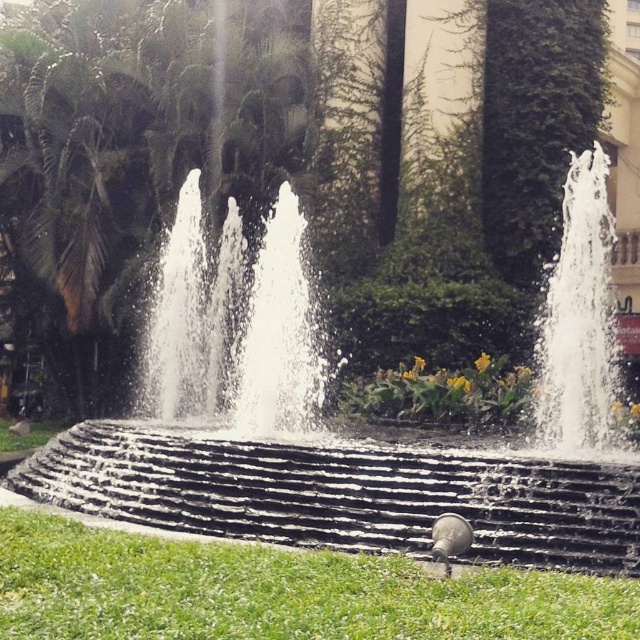
Between point (401, 589) and point (579, 161), which one is positioned in front?

Positioned in front is point (401, 589).

Describe the element at coordinates (276, 593) in the screenshot. I see `green grass at lower center` at that location.

Describe the element at coordinates (276, 593) in the screenshot. The width and height of the screenshot is (640, 640). I see `green grass at lower center` at that location.

Where is `green grass at lower center`? Image resolution: width=640 pixels, height=640 pixels. green grass at lower center is located at coordinates (276, 593).

Which of these two, black stone fountain at center or green grass at lower center, stands taller?

With more height is black stone fountain at center.

Who is shorter, black stone fountain at center or green grass at lower center?

With less height is green grass at lower center.

Does point (544, 332) come farther from viewer compared to point (188, 554)?

That is True.

You are a GUI agent. You are given a task and a screenshot of the screen. Output one action in this format:
    pyautogui.click(x=<x>, y=<y>)
    Task: Click on the black stone fountain at center
    
    Given the screenshot: What is the action you would take?
    pos(394,454)

Is point (436, 467) closer to viewer compared to point (596, 342)?

Yes, it is.

Is black stone fountain at center in front of clear glass water at upper right?

Yes.

Between point (253, 477) and point (612, 353), which one is positioned in front?

Point (253, 477) is in front.

Identify the location of black stone fountain at center. (394, 454).